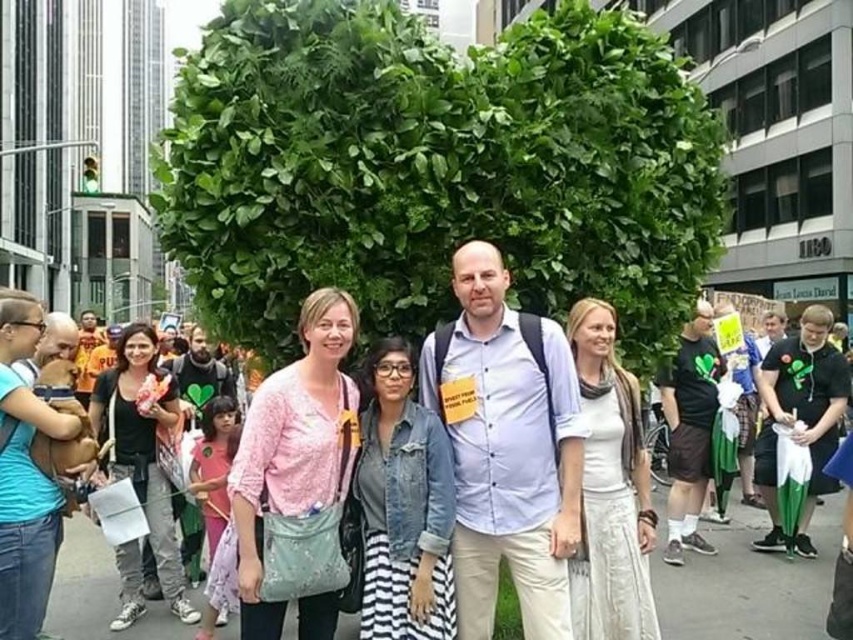
You are taking a photo of the green leafy tree at center and the pink fabric shirt at center in the urban scene. Which object should you focus on first if you want to capture both in the same frame without moving the camera?

You should focus on the green leafy tree at center first because it is positioned to the left of the pink fabric shirt at center, so adjusting focus from left to right would ensure both are in the frame.

Based on the coordinates provided, where is the green leafy tree at center located in the image?

The green leafy tree at center is located at the coordinates point (434, 168).

From the picture: You are a photographer standing in the crowd and want to take a photo of both the green leafy tree at center and the pink fabric shirt at center without any obstructions. Given that your camera has a maximum focus range of 10 feet, will you be able to capture both subjects clearly in the same frame?

The green leafy tree at center is 11.71 feet from the pink fabric shirt at center. Since the distance between them exceeds the camera maximum focus range of 10 feet, you will not be able to capture both subjects clearly in the same frame.